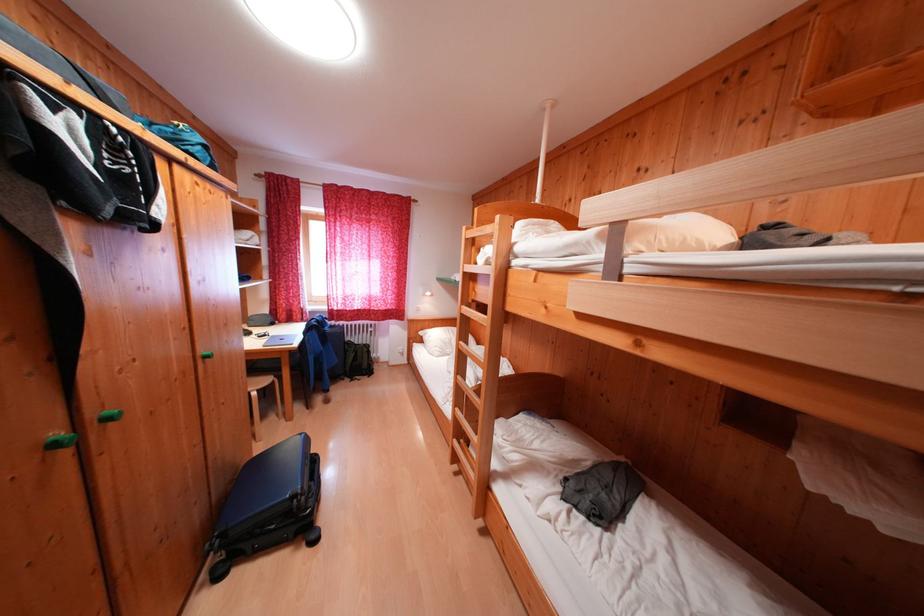
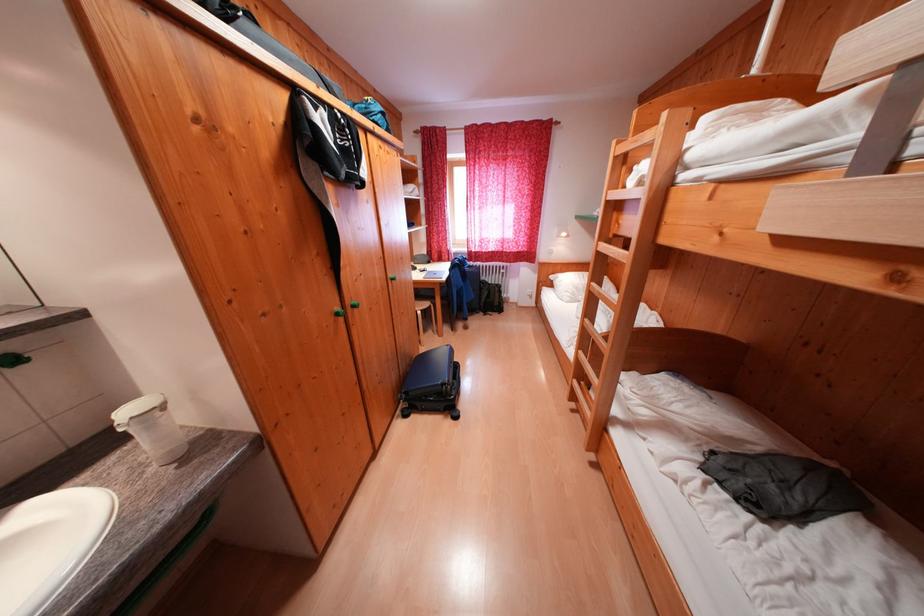
Find the pixel in the second image that matches point (189, 130) in the first image.

(378, 103)